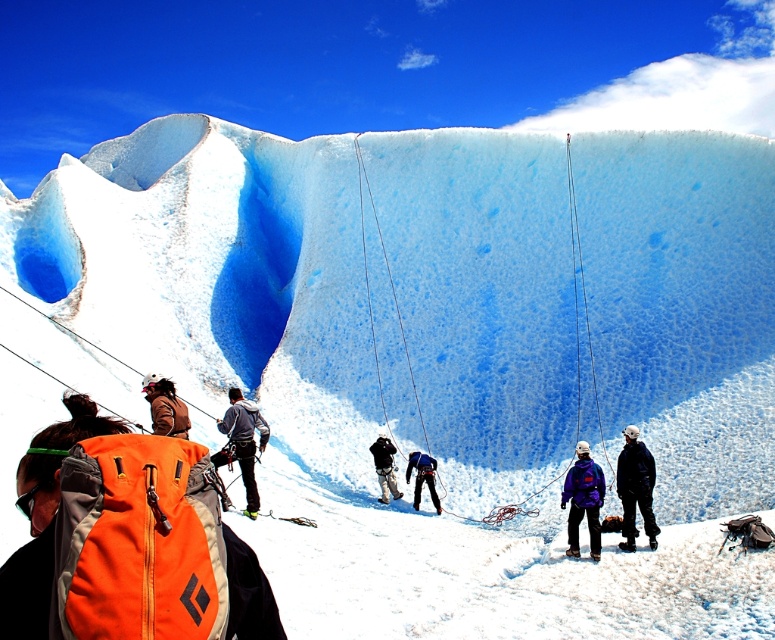
You are a photographer standing at the base of the glacier. You see the black matte jacket at center and a camera. Which object is closer to you?

The black matte jacket at center is closer to you than the camera, as they are 47.33 meters apart.

You are standing at the point marked as point (x=629, y=464) on the glacier. A climber in orange is 48.48 meters away from you. Can you see the climber in orange clearly?

The point (x=629, y=464) is 48.48 meters away from the viewer, so yes, the climber in orange is within that distance and can be seen clearly.